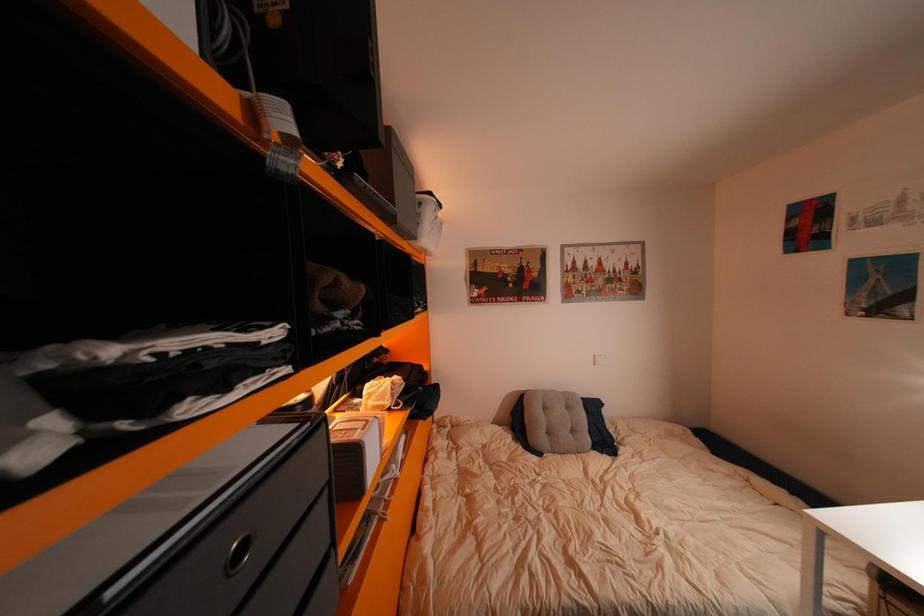
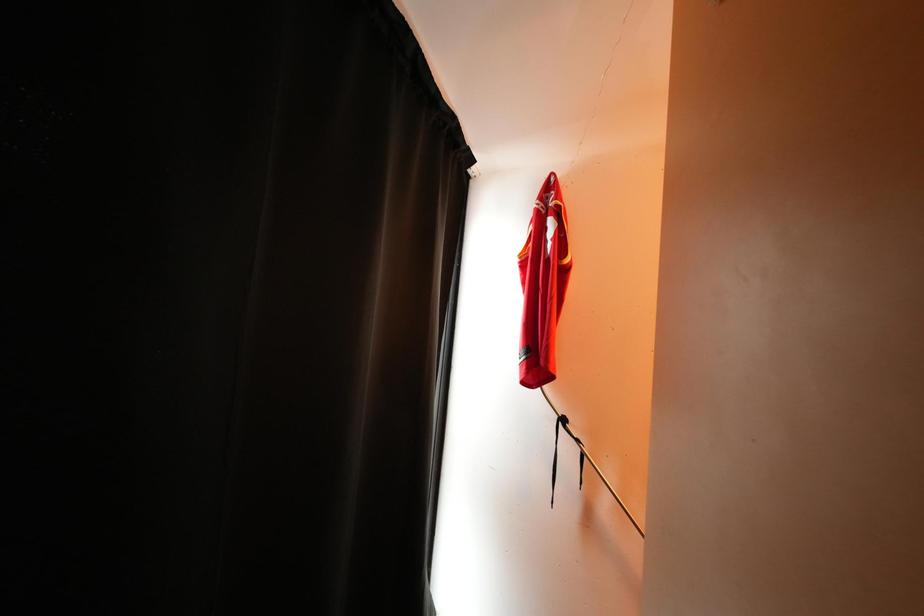
Question: How did the camera likely rotate?

Choices:
 (A) Left
 (B) Right
 (C) Up
 (D) Down

Answer: (A)